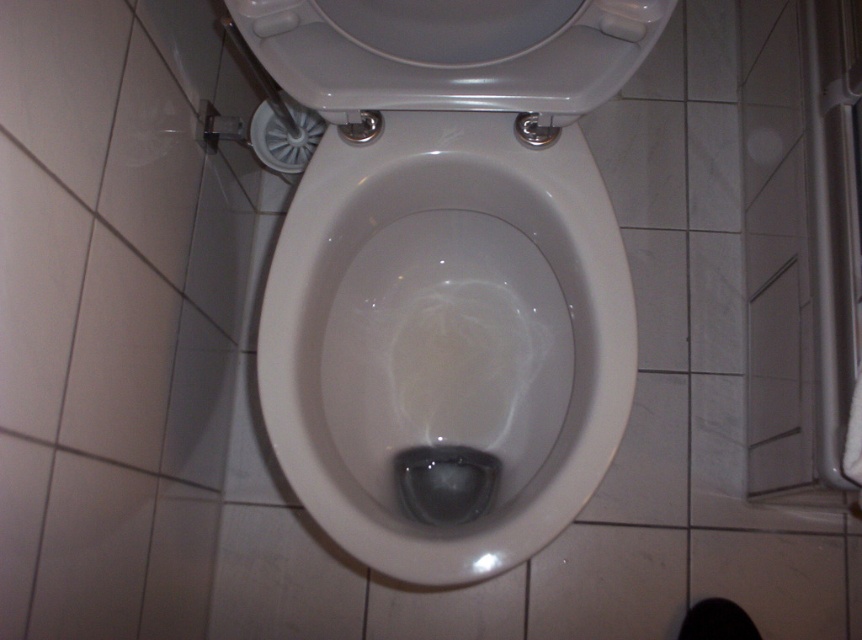
Question: Does white glossy toilet bowl at center have a larger size compared to white glossy tile at lower center?

Choices:
 (A) yes
 (B) no

Answer: (A)

Question: Based on their relative distances, which object is farther from the white glossy tile at lower center?

Choices:
 (A) white glossy toilet bowl at center
 (B) white glossy toilet seat at upper center

Answer: (B)

Question: Which object appears farthest from the camera in this image?

Choices:
 (A) white glossy tile at lower center
 (B) white glossy toilet bowl at center

Answer: (A)

Question: Which point is closer to the camera?

Choices:
 (A) (606, 573)
 (B) (330, 432)
 (C) (255, 12)

Answer: (C)

Question: Can you confirm if white glossy toilet bowl at center is smaller than white glossy tile at lower center?

Choices:
 (A) no
 (B) yes

Answer: (A)

Question: Is white glossy toilet seat at upper center above white glossy tile at lower center?

Choices:
 (A) no
 (B) yes

Answer: (B)